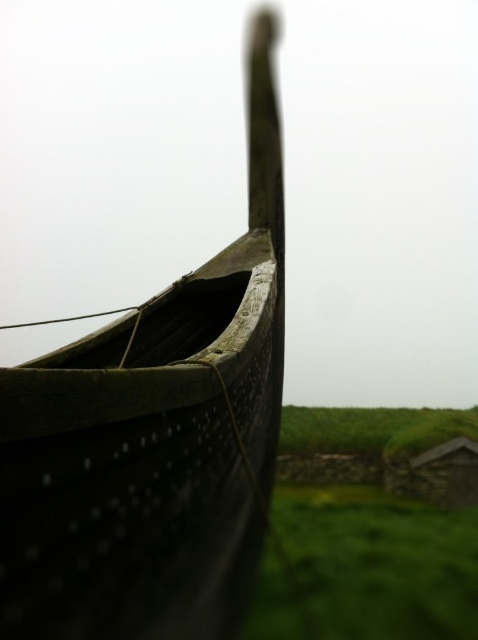
Based on the scene description, what object is located at the coordinates point (x=154, y=436)?

The dark wood boat at center is located at point (x=154, y=436).